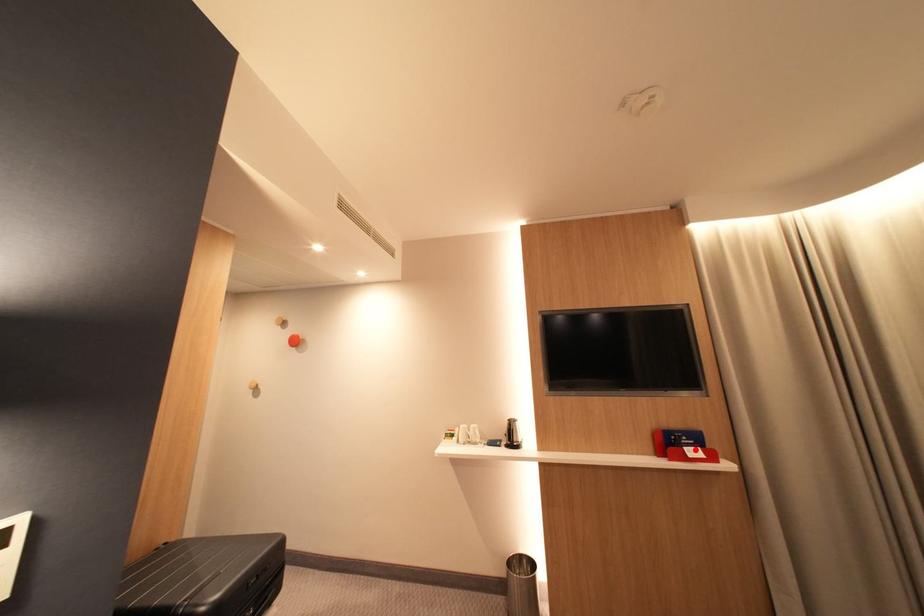
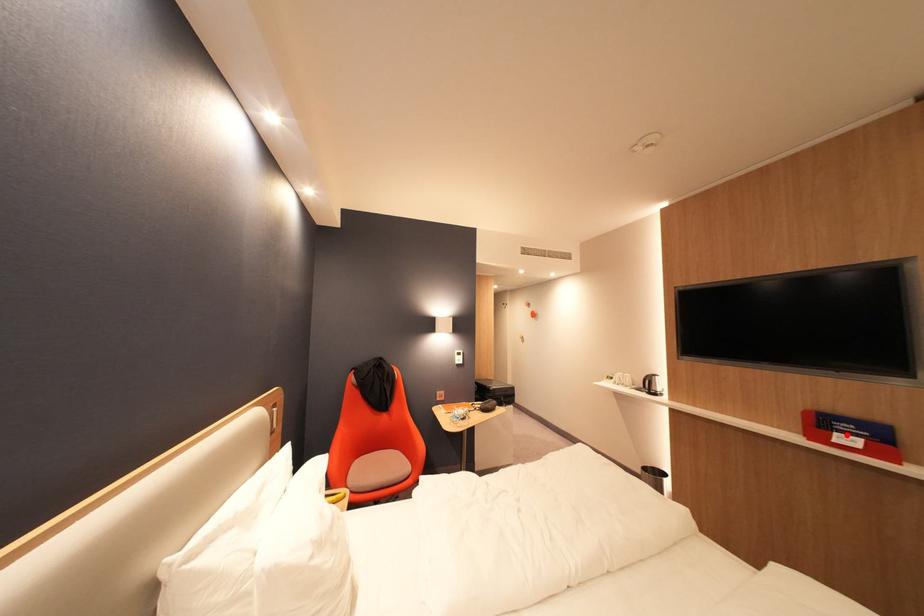
I am providing you with two images of the same scene from different viewpoints. A red point is marked on the first image and another point is marked on the second image. Is the red point in image1 aligned with the point shown in image2?

Yes